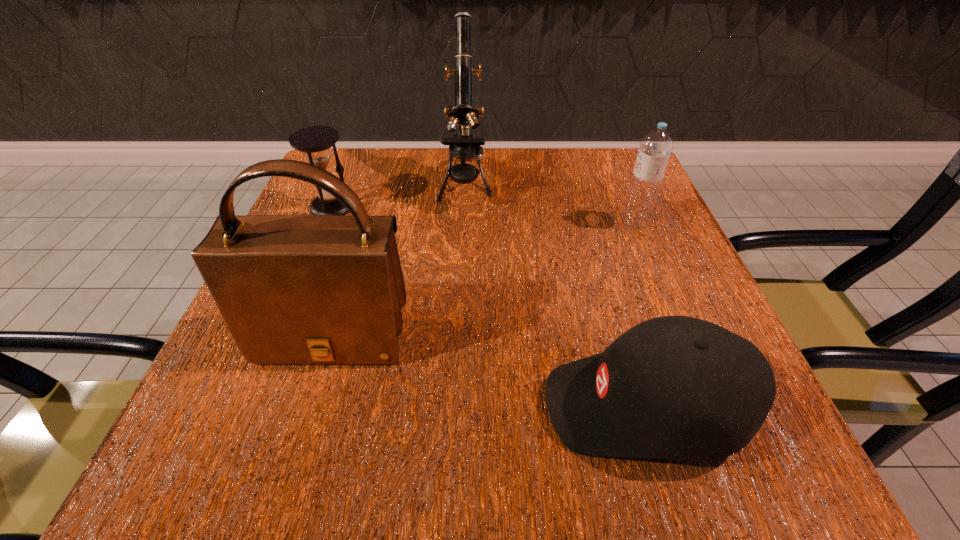
Find the location of `vacant space located with a logo on the front of the shortest object`. vacant space located with a logo on the front of the shortest object is located at coordinates (460, 406).

Where is `vacant position located 0.110m with a logo on the front of the shortest object`? This screenshot has width=960, height=540. vacant position located 0.110m with a logo on the front of the shortest object is located at coordinates (460, 406).

In order to click on microscope at the far edge in this screenshot , I will do `click(464, 146)`.

Locate an element on the screen. hourglass that is at the far edge is located at coordinates (316, 141).

The height and width of the screenshot is (540, 960). I want to click on object present at the near edge, so click(674, 387).

You are a GUI agent. You are given a task and a screenshot of the screen. Output one action in this format:
    pyautogui.click(x=<x>, y=<y>)
    Task: Click on the shoulder bag that is positioned at the left edge
    The height and width of the screenshot is (540, 960).
    Given the screenshot: What is the action you would take?
    pyautogui.click(x=292, y=289)

Where is `hourglass that is at the left edge`? Image resolution: width=960 pixels, height=540 pixels. hourglass that is at the left edge is located at coordinates (316, 141).

At what (x,y) coordinates should I click in order to perform the action: click on water bottle that is positioned at the right edge. Please return your answer as a coordinate pair (x, y). The width and height of the screenshot is (960, 540). Looking at the image, I should click on tap(655, 148).

Where is `baseball cap that is at the right edge`? The image size is (960, 540). baseball cap that is at the right edge is located at coordinates (674, 387).

The image size is (960, 540). Identify the location of object at the far left corner. (316, 141).